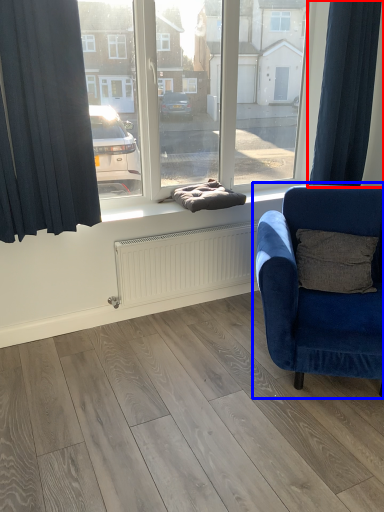
Question: Which point is further to the camera, curtain (highlighted by a red box) or chair (highlighted by a blue box)?

Choices:
 (A) curtain
 (B) chair

Answer: (A)